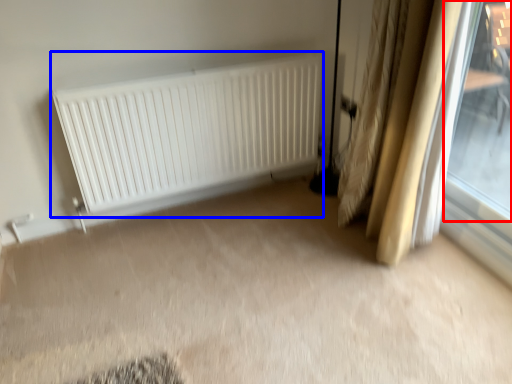
Question: Which point is closer to the camera, window (highlighted by a red box) or radiator (highlighted by a blue box)?

Choices:
 (A) window
 (B) radiator

Answer: (A)